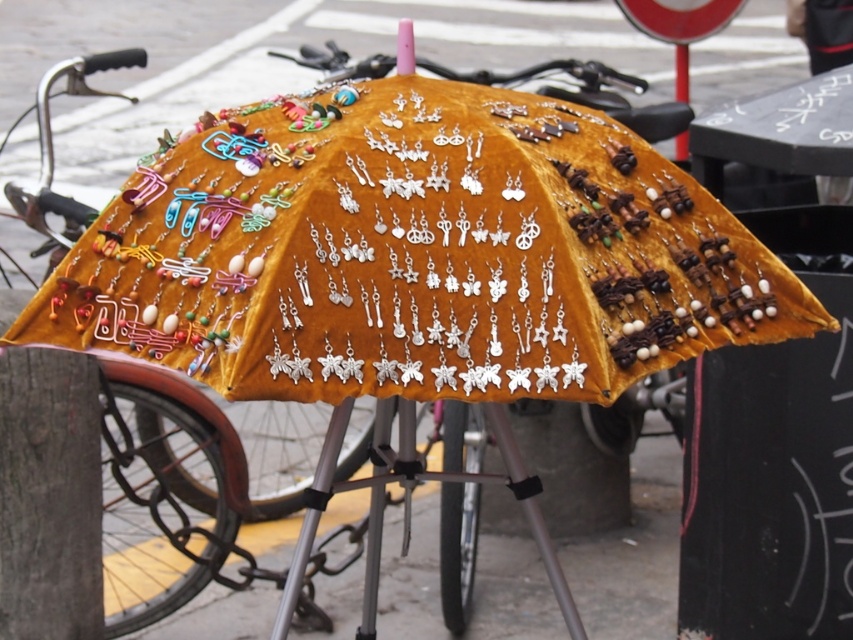
From the picture: You are a street vendor who wants to move the velvet umbrella at center to a different location. However, you must ensure that the umbrella remains under the black plastic pole at upper right. Is this possible given their current positions?

The velvet umbrella at center is already positioned under the black plastic pole at upper right, so moving it while keeping it under the pole is possible as long as the new location is still within the area under the pole.

You are a customer walking down the street and see the velvet umbrella at center and the black plastic pole at upper right. Which object is positioned more to the left side of your view?

The velvet umbrella at center is positioned to the left of the black plastic pole at upper right, so the velvet umbrella at center is more to the left side of your view.

You are a street vendor who wants to ensure your velvet umbrella at center and black plastic pole at upper right are visible to passersby. Given their sizes, which object might you need to place closer to the front of your display to ensure visibility?

The velvet umbrella at center is larger than the black plastic pole at upper right, so you should place the black plastic pole at upper right closer to the front of the display to ensure it remains visible to passersby.